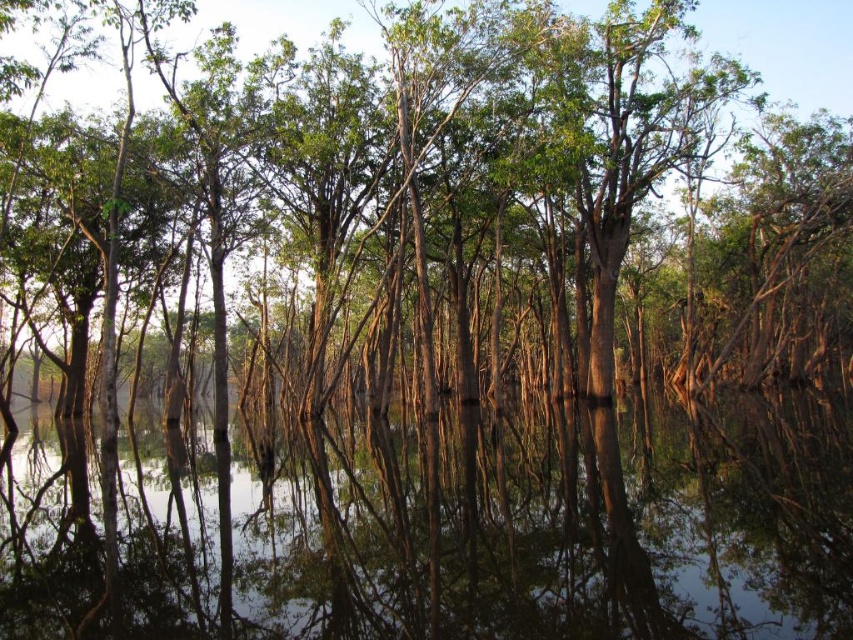
You are standing in the wetland scene and want to place a small marker at each of the two points, point (125, 509) and point (851, 67). Which point will require you to walk further away from your current position to reach?

Point (851, 67) is further from the viewer than point (125, 509), so you will need to walk further to reach point (851, 67).

You are standing at the edge of the wetland and want to cross to the other side. The clear water at center is your only path. What is the exact coordinate where you should step to safely cross the water?

The exact coordinate to safely cross the clear water at center is at point (438, 524).

You are standing in the wetland and want to take a photo of the clear water at center and the green matte tree at center. Which object should you focus on first to ensure both are in sharp focus?

You should focus on the green matte tree at center first because it is farther away from the viewer than the clear water at center. By focusing on the farther object, you can ensure that the closer object will also be in focus due to the depth of field.